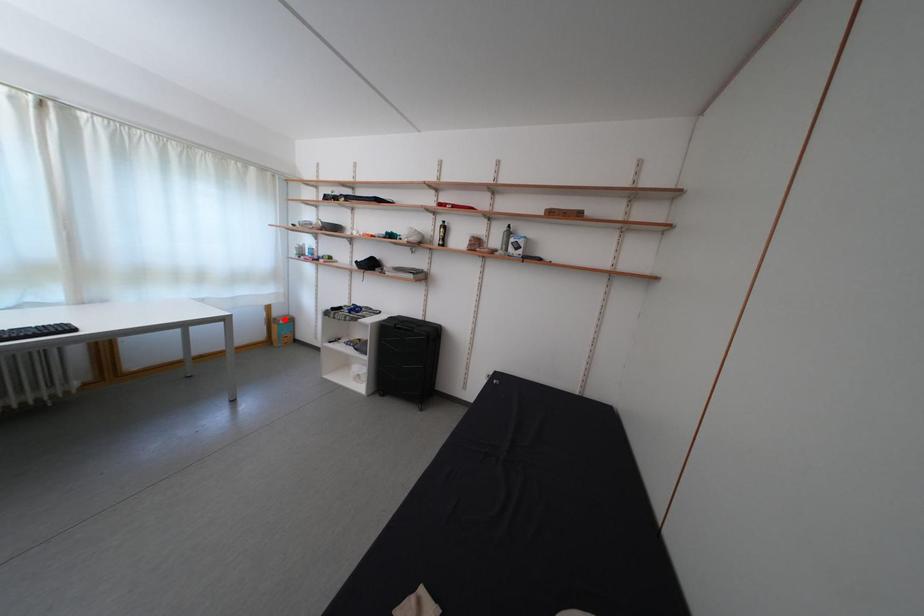
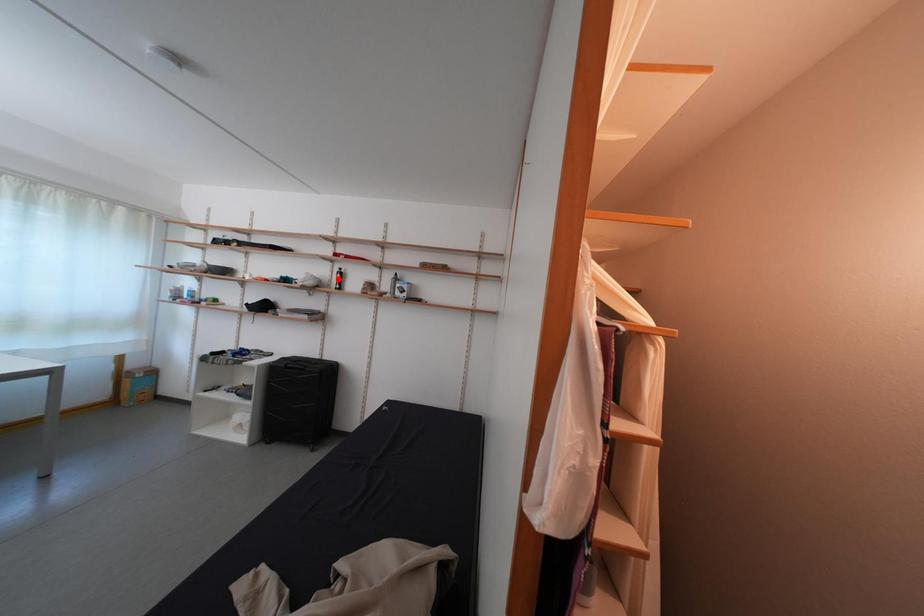
I am providing you with two images of the same scene from different viewpoints. A red point is marked on the first image and another point is marked on the second image. Is the marked point in image1 the same physical position as the marked point in image2?

No